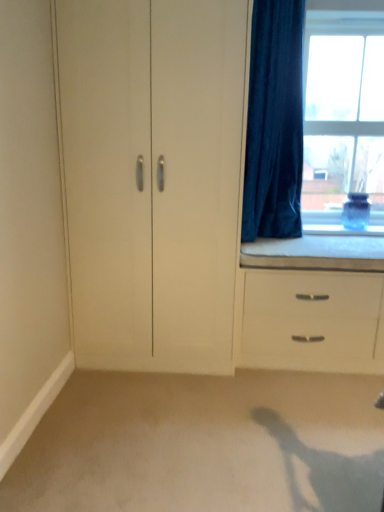
Question: Is beige carpet at lower center bigger or smaller than velvet dark blue curtain at right?

Choices:
 (A) big
 (B) small

Answer: (B)

Question: Considering the relative positions of beige carpet at lower center and velvet dark blue curtain at right in the image provided, is beige carpet at lower center to the left or to the right of velvet dark blue curtain at right?

Choices:
 (A) right
 (B) left

Answer: (B)

Question: Estimate the real-world distances between objects in this image. Which object is farther from the clear glass window at upper right?

Choices:
 (A) white foam cushion at window
 (B) white matte cabinet at center
 (C) white matte chest of drawers at lower right
 (D) velvet dark blue curtain at right
 (E) beige carpet at lower center

Answer: (E)

Question: Which object is positioned farthest from the white foam cushion at window?

Choices:
 (A) velvet dark blue curtain at right
 (B) beige carpet at lower center
 (C) white matte cabinet at center
 (D) white matte chest of drawers at lower right
 (E) clear glass window at upper right

Answer: (B)